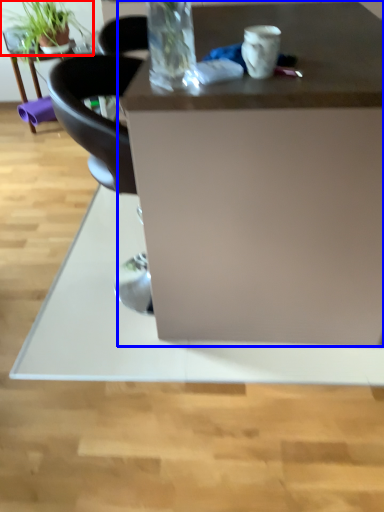
Question: Among these objects, which one is farthest to the camera, houseplant (highlighted by a red box) or desk (highlighted by a blue box)?

Choices:
 (A) houseplant
 (B) desk

Answer: (A)